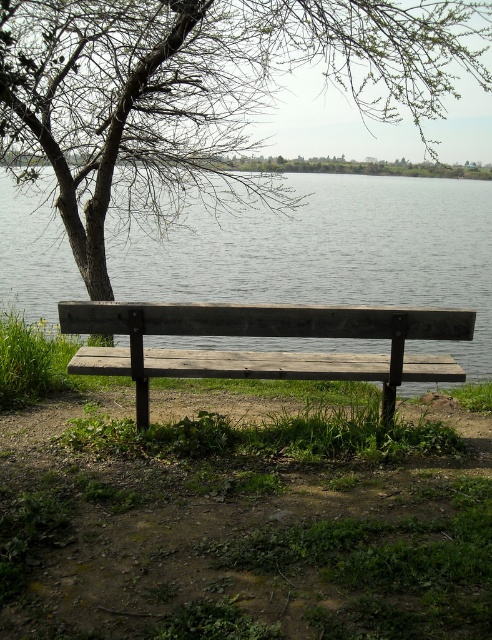
Can you confirm if gray water at bench right is taller than weathered wood bench at center?

Indeed, gray water at bench right has a greater height compared to weathered wood bench at center.

Where is `gray water at bench right`? The width and height of the screenshot is (492, 640). gray water at bench right is located at coordinates (332, 253).

This screenshot has width=492, height=640. In order to click on gray water at bench right in this screenshot , I will do tap(332, 253).

Which is above, brown wood tree at upper left or gray water at bench right?

brown wood tree at upper left

Consider the image. Can you confirm if brown wood tree at upper left is positioned below gray water at bench right?

No, brown wood tree at upper left is not below gray water at bench right.

Does point (30, 68) lie behind point (412, 195)?

No.

Where is `brown wood tree at upper left`? The image size is (492, 640). brown wood tree at upper left is located at coordinates (200, 92).

Can you confirm if brown wood tree at upper left is positioned to the right of weathered wood bench at center?

No, brown wood tree at upper left is not to the right of weathered wood bench at center.

Is point (134, 122) in front of point (294, 312)?

No.

Identify the location of brown wood tree at upper left. This screenshot has height=640, width=492. [200, 92].